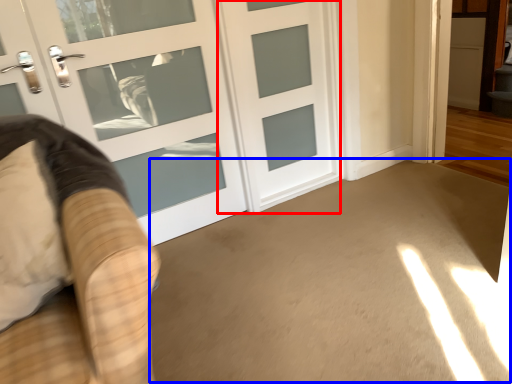
Question: Which point is further to the camera, door (highlighted by a red box) or corridor (highlighted by a blue box)?

Choices:
 (A) door
 (B) corridor

Answer: (A)